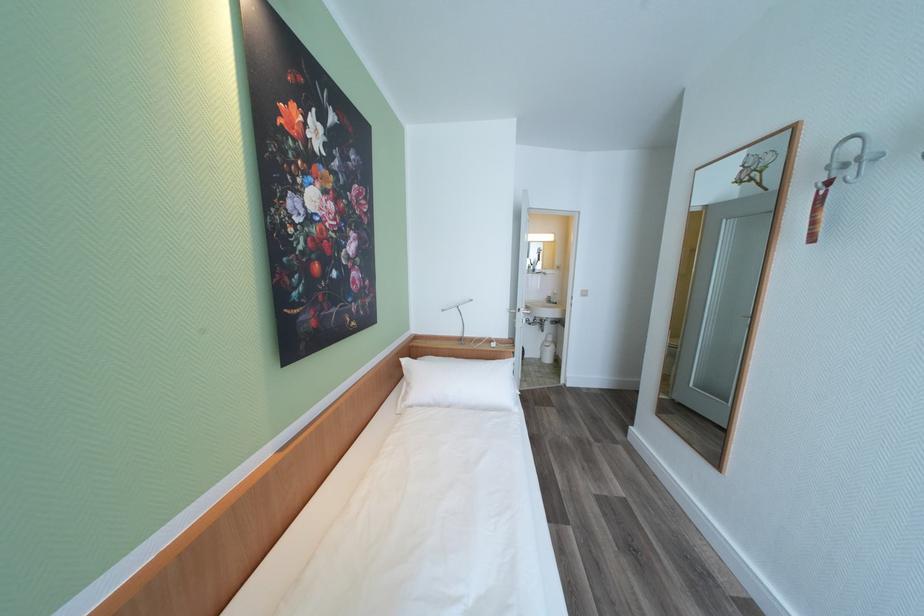
Where would you hang the white coat hook? Please return your answer as a coordinate pair (x, y).

(869, 167)